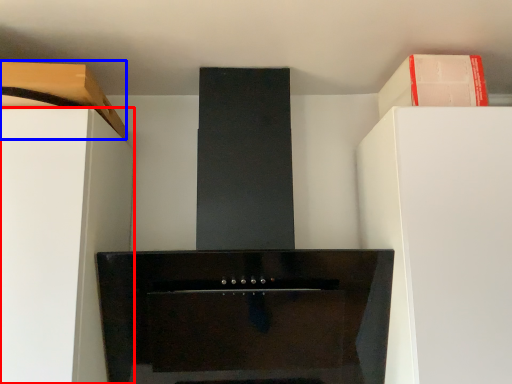
Question: Which point is closer to the camera, furniture (highlighted by a red box) or cabinetry (highlighted by a blue box)?

Choices:
 (A) furniture
 (B) cabinetry

Answer: (A)